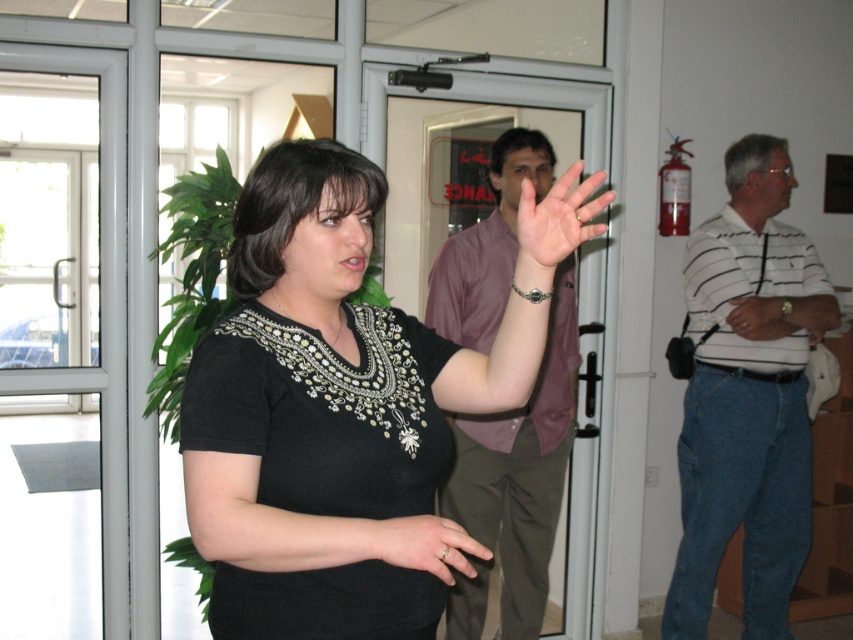
Is point (511, 365) in front of point (509, 228)?

Yes, point (511, 365) is in front of point (509, 228).

Is point (288, 358) positioned behind point (502, 307)?

No, it is in front of (502, 307).

Image resolution: width=853 pixels, height=640 pixels. What are the coordinates of `black matte shirt at center` in the screenshot? It's located at (328, 410).

Is point (263, 429) closer to viewer compared to point (553, 339)?

Yes.

Can you confirm if black matte shirt at center is thinner than brown fabric shirt at center?

Incorrect, black matte shirt at center's width is not less than brown fabric shirt at center's.

Is point (345, 547) positioned before point (502, 232)?

Yes, point (345, 547) is in front of point (502, 232).

Locate an element on the screen. The width and height of the screenshot is (853, 640). black matte shirt at center is located at coordinates (328, 410).

Image resolution: width=853 pixels, height=640 pixels. Describe the element at coordinates (521, 468) in the screenshot. I see `brown fabric shirt at center` at that location.

Is brown fabric shirt at center below black matte ring at center?

No, brown fabric shirt at center is not below black matte ring at center.

This screenshot has width=853, height=640. Describe the element at coordinates (521, 468) in the screenshot. I see `brown fabric shirt at center` at that location.

Image resolution: width=853 pixels, height=640 pixels. In order to click on brown fabric shirt at center in this screenshot , I will do `click(521, 468)`.